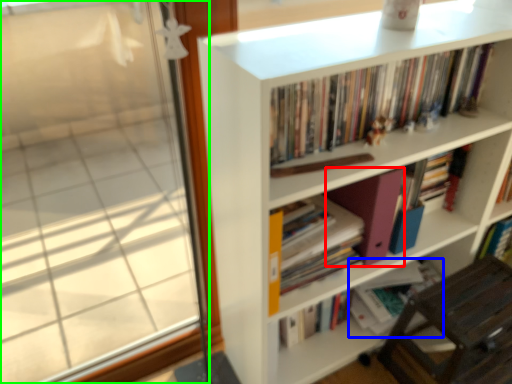
Question: Estimate the real-world distances between objects in this image. Which object is closer to paperback book (highlighted by a red box), book (highlighted by a blue box) or window (highlighted by a green box)?

Choices:
 (A) book
 (B) window

Answer: (A)